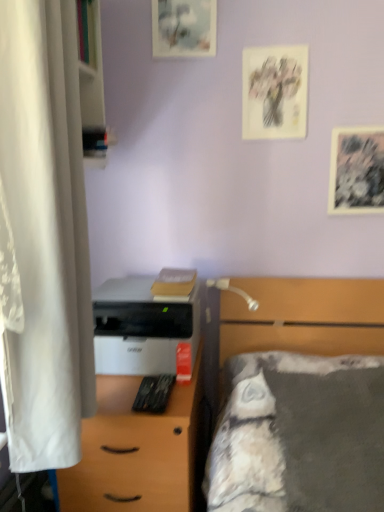
Question: Choose the correct answer: Is gray fabric bed at right inside white matte desk at center or outside it?

Choices:
 (A) outside
 (B) inside

Answer: (A)

Question: Is gray fabric bed at right to the left or to the right of white matte desk at center in the image?

Choices:
 (A) right
 (B) left

Answer: (A)

Question: Which is farther from the black textured paper at upper right, which appears as the 1th picture frame when viewed from the right?

Choices:
 (A) matte paper picture frame at upper center, the third picture frame ordered from the bottom
 (B) white matte printer at center
 (C) white fabric curtain at left
 (D) gray fabric bed at right
 (E) white matte desk at center

Answer: (C)

Question: Which is farther from the white fabric curtain at left?

Choices:
 (A) matte paper picture frame at upper right, the second picture frame from the top
 (B) black textured paper at upper right, the third picture frame in the left-to-right sequence
 (C) white matte printer at center
 (D) matte paper picture frame at upper center, the third picture frame ordered from the bottom
 (E) white wood bookshelf at left

Answer: (B)